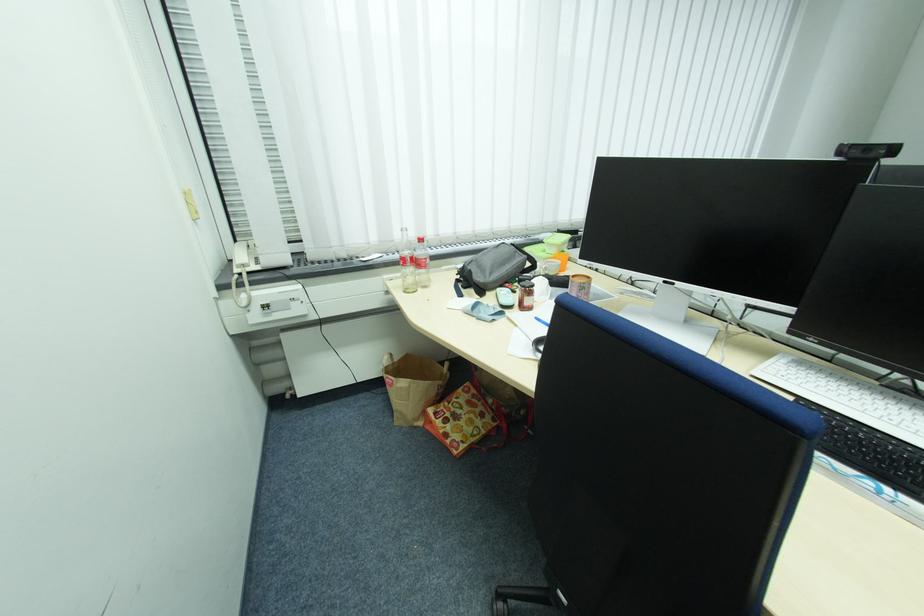
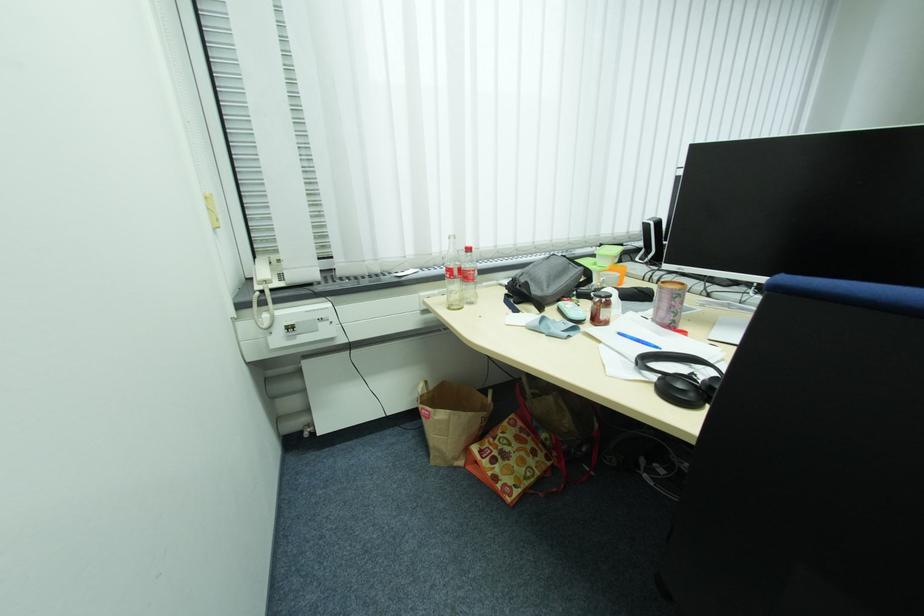
Where in the second image is the point corresponding to point 241,240 from the first image?

(261, 256)